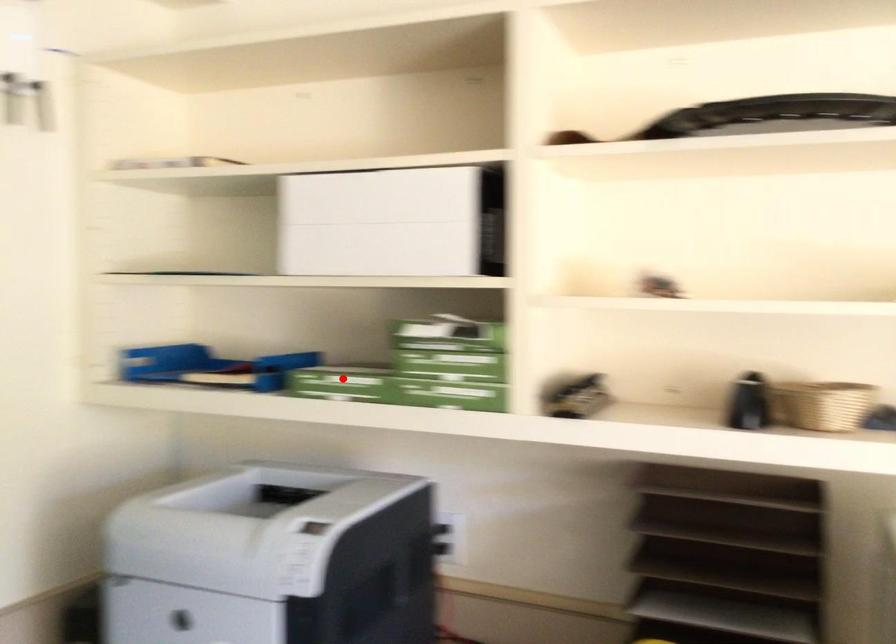
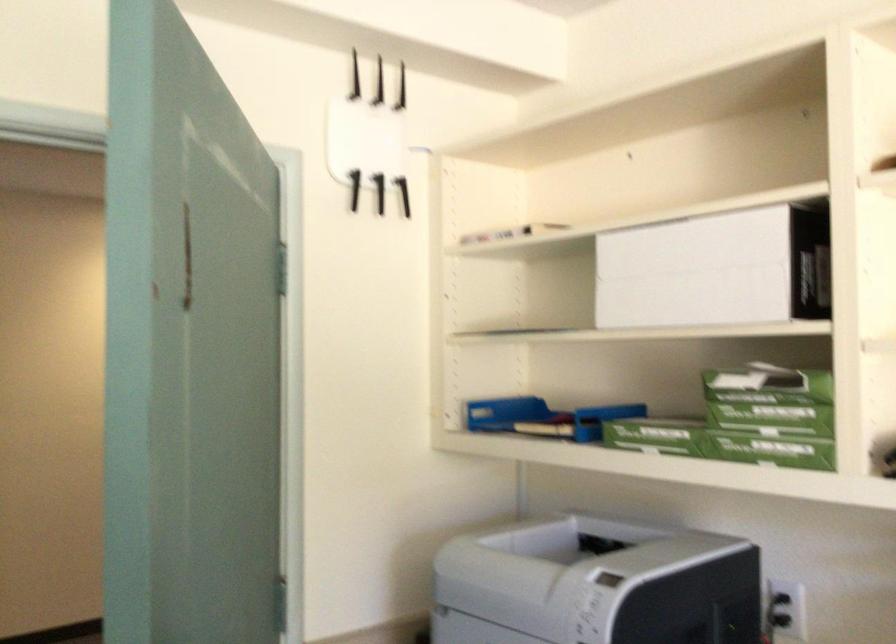
Locate, in the second image, the point that corresponds to the highlighted location in the first image.

(655, 435)